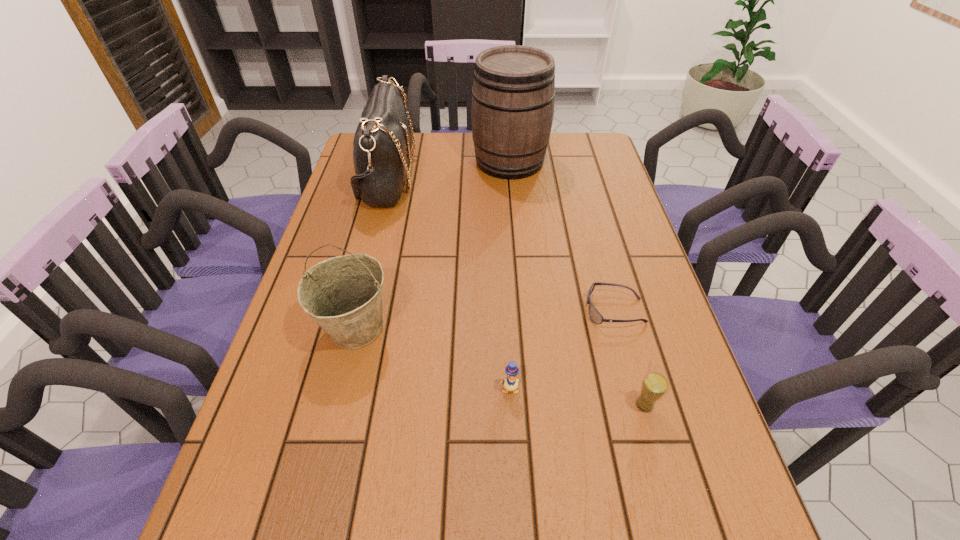
Locate an element on the screen. The height and width of the screenshot is (540, 960). straw for drinking that is positioned at the right edge is located at coordinates (654, 385).

Identify the location of sunglasses located at the right edge. coord(595,316).

Locate an element on the screen. This screenshot has height=540, width=960. object at the far left corner is located at coordinates (382, 143).

Find the location of a particular element. The image size is (960, 540). vacant space at the far edge of the desktop is located at coordinates (551, 160).

Locate an element on the screen. blank space at the left edge of the desktop is located at coordinates (375, 239).

The image size is (960, 540). In the image, there is a desktop. Find the location of `blank space at the right edge`. blank space at the right edge is located at coordinates pos(640,245).

Identify the location of free space at the far right corner of the desktop. coord(588,143).

This screenshot has height=540, width=960. In order to click on vacant region between the duckling and the handbag in this screenshot , I will do `click(448, 283)`.

Find the location of a particular element. The width and height of the screenshot is (960, 540). vacant space in between the handbag and the sunglasses is located at coordinates (501, 244).

You are a GUI agent. You are given a task and a screenshot of the screen. Output one action in this format:
    pyautogui.click(x=<x>, y=<y>)
    Task: Click on the free spot between the left wine bucket and the shortest object
    The image size is (960, 540).
    Given the screenshot: What is the action you would take?
    486,319